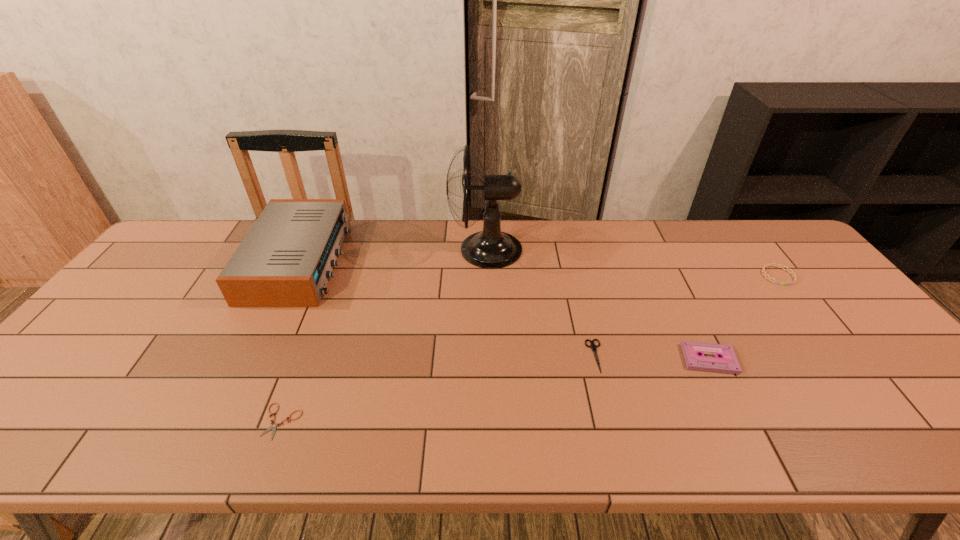
This screenshot has width=960, height=540. Find the location of `unoccupied position between the fan and the radio receiver`. unoccupied position between the fan and the radio receiver is located at coordinates (393, 255).

I want to click on vacant point located between the taller shears and the rightmost object, so click(686, 316).

Find the location of a particular element. vacant point located between the second tallest object and the farther shears is located at coordinates (447, 308).

Locate an element on the screen. The height and width of the screenshot is (540, 960). vacant space in between the left shears and the videotape is located at coordinates (495, 390).

Locate an element on the screen. This screenshot has width=960, height=540. free space between the fourth object from right to left and the shortest object is located at coordinates (384, 335).

Locate an element on the screen. Image resolution: width=960 pixels, height=540 pixels. free space between the fan and the bracelet is located at coordinates point(632,262).

Find the location of a particular element. The image size is (960, 540). free space between the shortest object and the tallest object is located at coordinates (384, 335).

Locate an element on the screen. the fifth closest object to the fifth object from left to right is located at coordinates (285, 260).

Identify which object is located as the fifth nearest to the videotape. Please provide its 2D coordinates. Your answer should be formatted as a tuple, i.e. [(x, y)], where the tuple contains the x and y coordinates of a point satisfying the conditions above.

[(285, 260)]

Where is `vacant region that satisfies the following two spatial constraints: 1. on the back side of the third object from right to left; 2. on the front-facing side of the tallest object`? Image resolution: width=960 pixels, height=540 pixels. vacant region that satisfies the following two spatial constraints: 1. on the back side of the third object from right to left; 2. on the front-facing side of the tallest object is located at coordinates (569, 249).